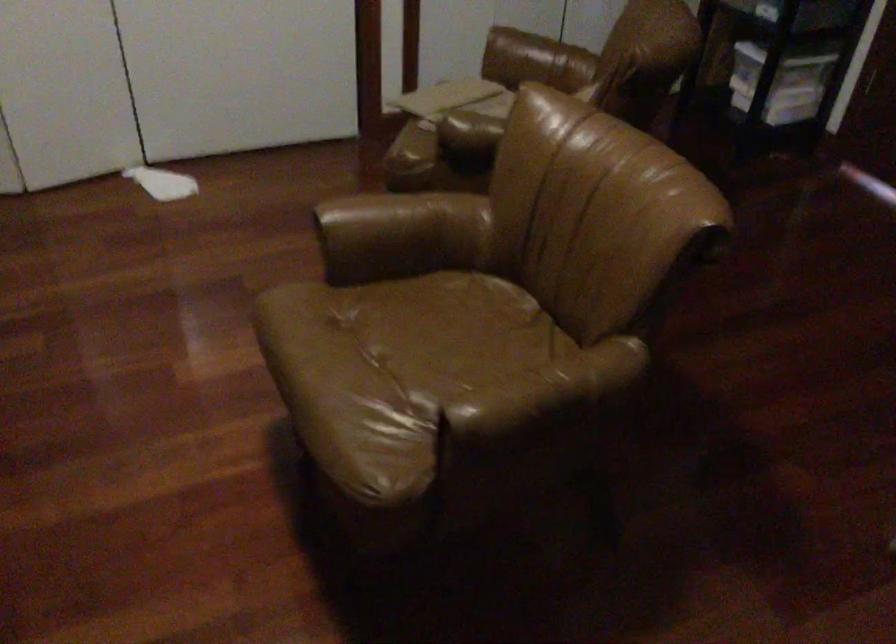
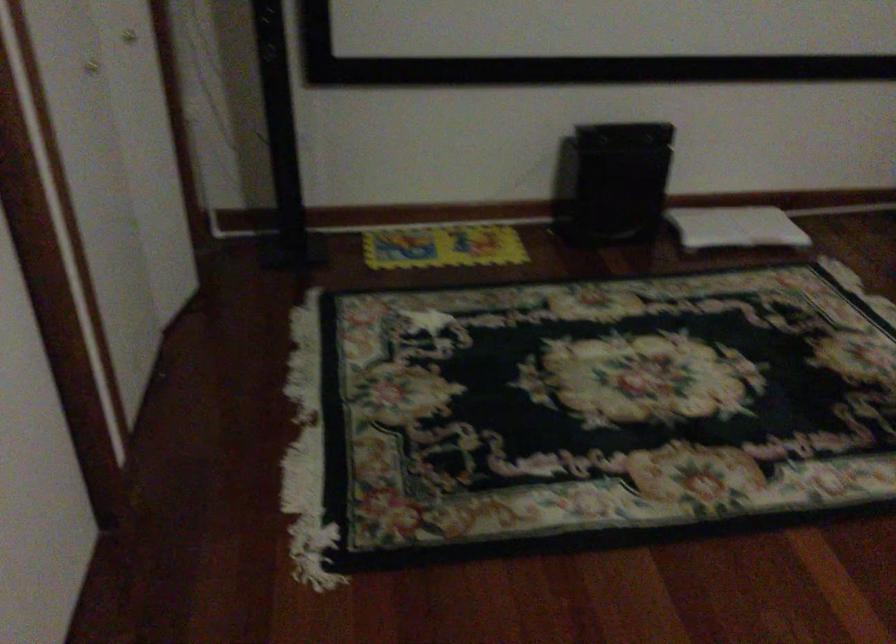
Based on the continuous images, in which direction is the camera rotating?

The camera's rotation is toward left-down.